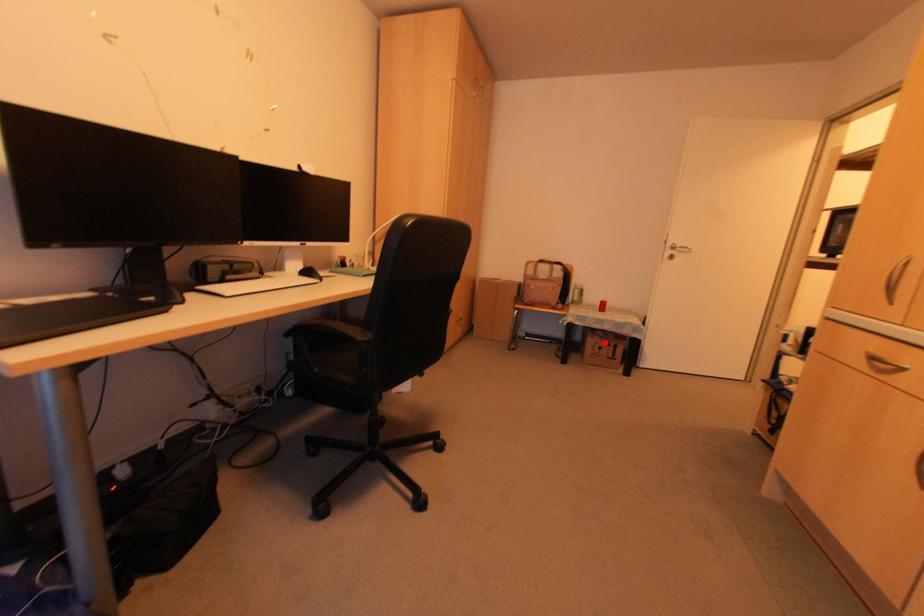
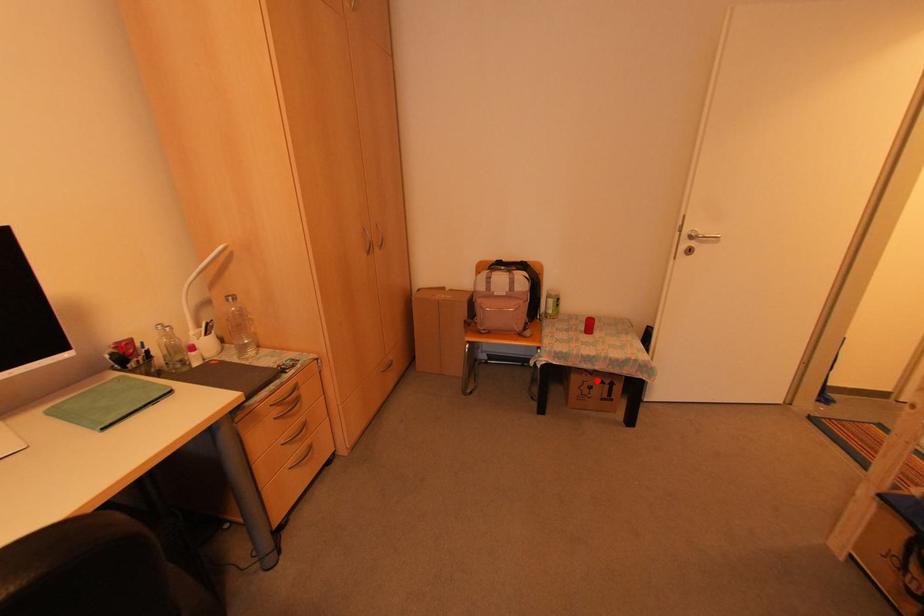
I am providing you with two images of the same scene from different viewpoints. A red point is marked on the first image and another point is marked on the second image. Does the point marked in image1 correspond to the same location as the one in image2?

Yes